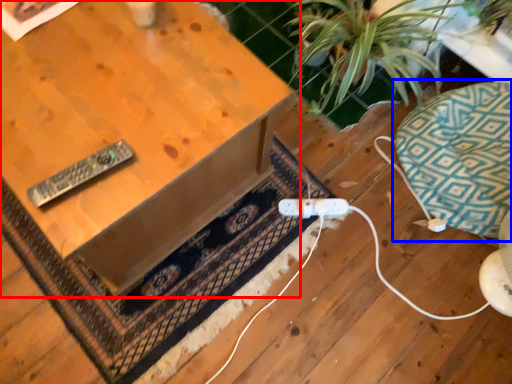
Question: Which of the following is the closest to the observer, table (highlighted by a red box) or swivel chair (highlighted by a blue box)?

Choices:
 (A) table
 (B) swivel chair

Answer: (A)